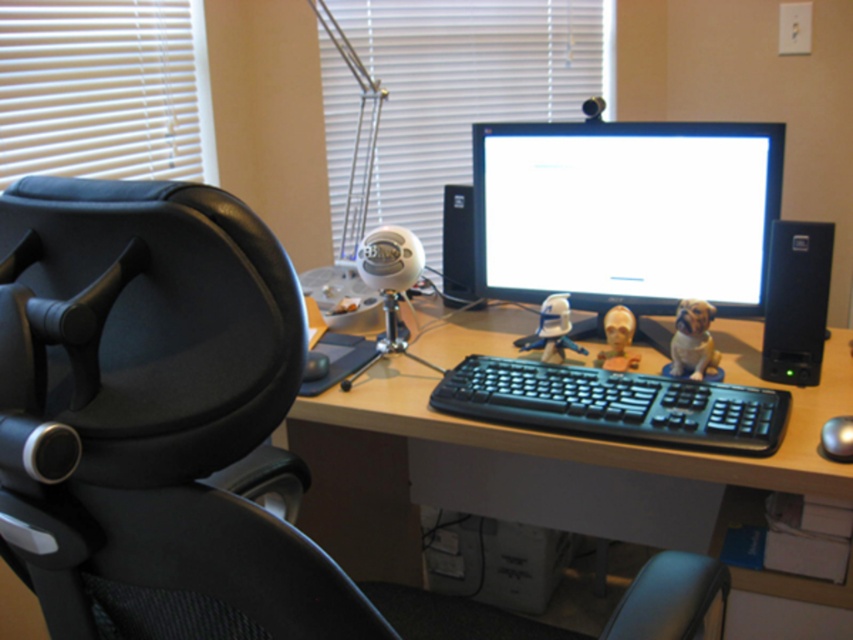
Please provide the coordinates of the wooden desk at center in the image. The coordinates should be in the format of a point with two decimal places, like this example format point example format point example format point example format point example format point example format point example format point example format point example format point example format point example format point example format point example format point example format point example format point example format point example format.

The wooden desk at center is located at point [538,465].

You are setting up a new keyboard in the home office. The keyboard is 40 cm wide. You want to place it between the white matte figurine at center and the glossy metallic mouse at center. Can the keyboard fit between them without overlapping?

The white matte figurine at center is wider than the glossy metallic mouse at center. However, the exact distance between them isn not provided. To determine if the keyboard can fit, you need to know the space between the two objects. Without that information, it is impossible to confirm if the 40 cm wide keyboard will fit.

You are a delivery robot that needs to place a package on the desk. The robot is 30 centimeters wide. Can it safely navigate between the wooden desk at center and the fuzzy beige dog at center right to reach the desk?

The distance between the wooden desk at center and the fuzzy beige dog at center right is 40.73 centimeters. Since the robot is 30 centimeters wide, it can safely pass through the space as 40.73 cm is wider than 30 cm.